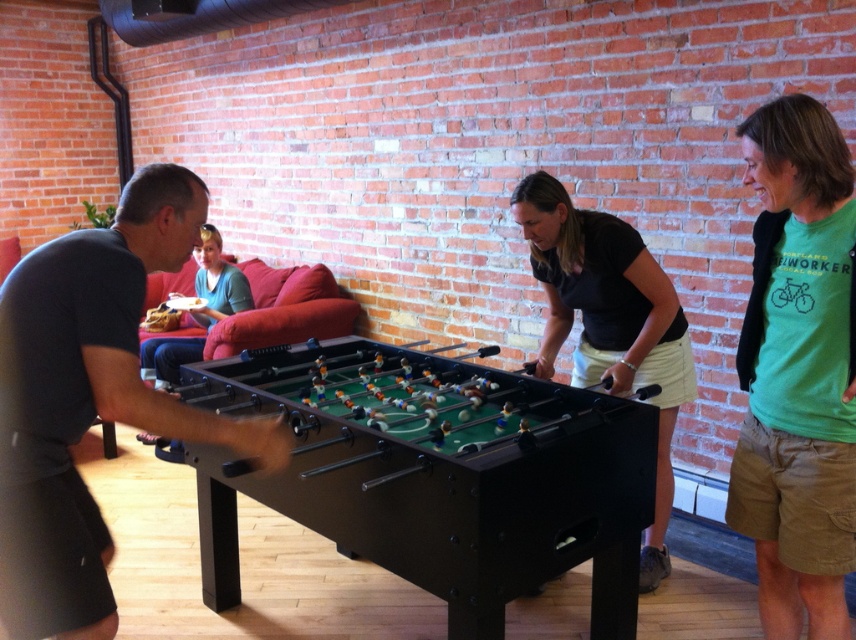
Question: Which point appears closest to the camera in this image?

Choices:
 (A) (456, 563)
 (B) (831, 365)

Answer: (A)

Question: Is dark gray shirt at left positioned behind green cotton t-shirt at center?

Choices:
 (A) no
 (B) yes

Answer: (A)

Question: Is black plastic foosball table at center behind dark gray shirt at left?

Choices:
 (A) yes
 (B) no

Answer: (A)

Question: Which point is farther to the camera?

Choices:
 (A) (253, 372)
 (B) (835, 144)
 (C) (10, 356)
 (D) (676, 336)

Answer: (A)

Question: Which is nearer to the dark gray shirt at left?

Choices:
 (A) black plastic foosball table at center
 (B) green cotton t-shirt at center

Answer: (A)

Question: Is dark gray shirt at left wider than blue cotton shirt at upper left?

Choices:
 (A) no
 (B) yes

Answer: (A)